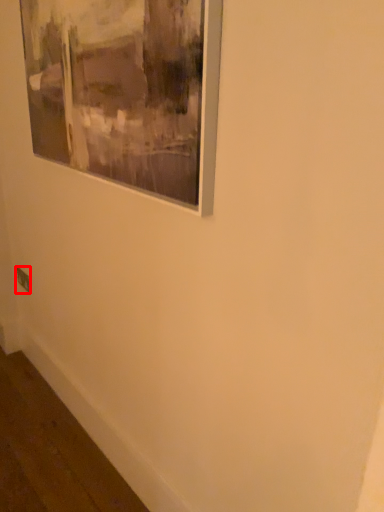
Question: From the image's perspective, what is the correct spatial positioning of electric outlet (annotated by the red box) in reference to picture frame?

Choices:
 (A) above
 (B) below

Answer: (B)